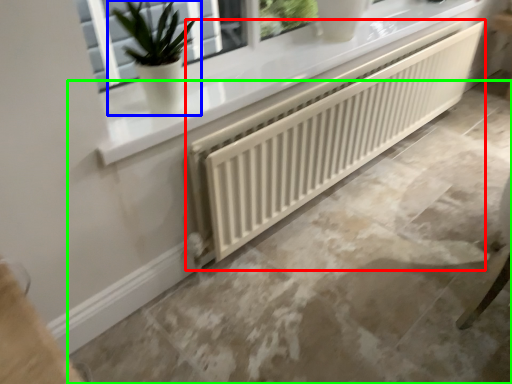
Question: Which is nearer to the radiator (highlighted by a red box)? houseplant (highlighted by a blue box) or concrete (highlighted by a green box).

Choices:
 (A) houseplant
 (B) concrete

Answer: (B)